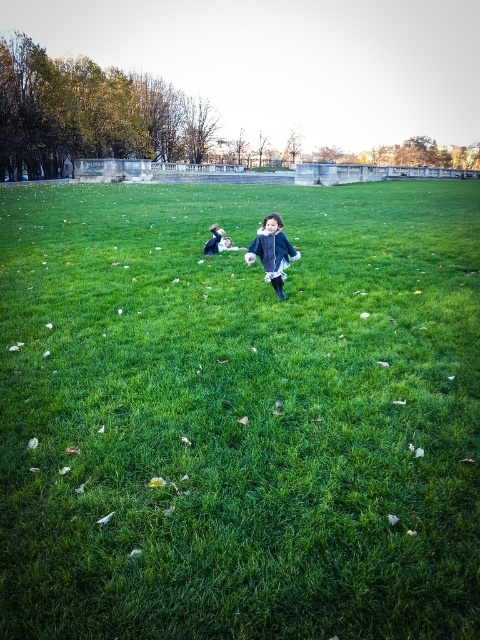
Can you confirm if green grass at center is thinner than matte black jacket at center?

No.

Is green grass at center above matte black jacket at center?

No.

The image size is (480, 640). I want to click on green grass at center, so click(x=240, y=413).

Can you confirm if green grass at center is positioned to the right of matte blue coat at center?

In fact, green grass at center is to the left of matte blue coat at center.

Is green grass at center closer to camera compared to matte blue coat at center?

Yes, green grass at center is closer to the viewer.

Is point (239, 314) positioned before point (265, 237)?

Yes, it is in front of point (265, 237).

I want to click on green grass at center, so click(240, 413).

Between matte blue coat at center and matte black jacket at center, which one is positioned higher?

matte black jacket at center

The width and height of the screenshot is (480, 640). Find the location of `matte blue coat at center`. matte blue coat at center is located at coordinates (273, 252).

Image resolution: width=480 pixels, height=640 pixels. In order to click on matte blue coat at center in this screenshot , I will do `click(273, 252)`.